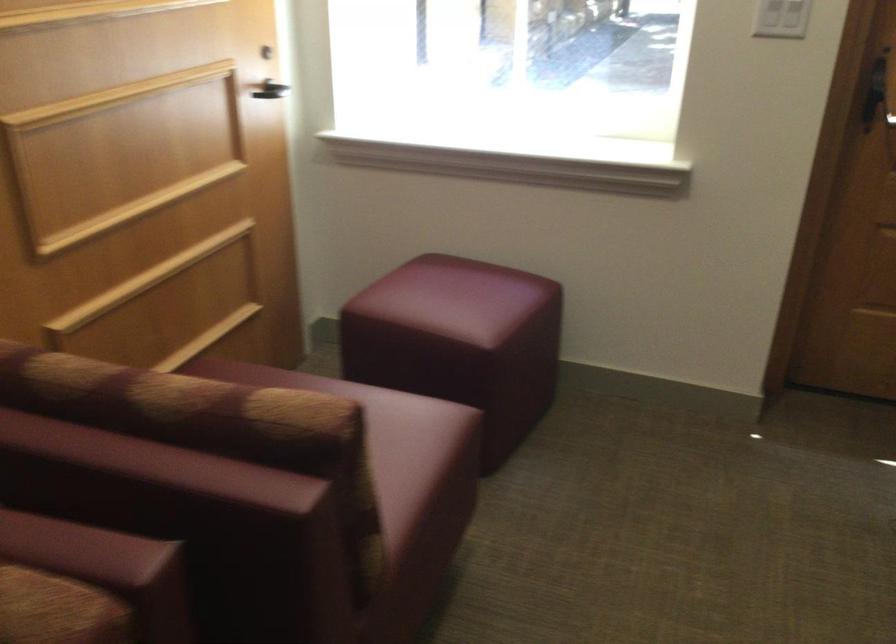
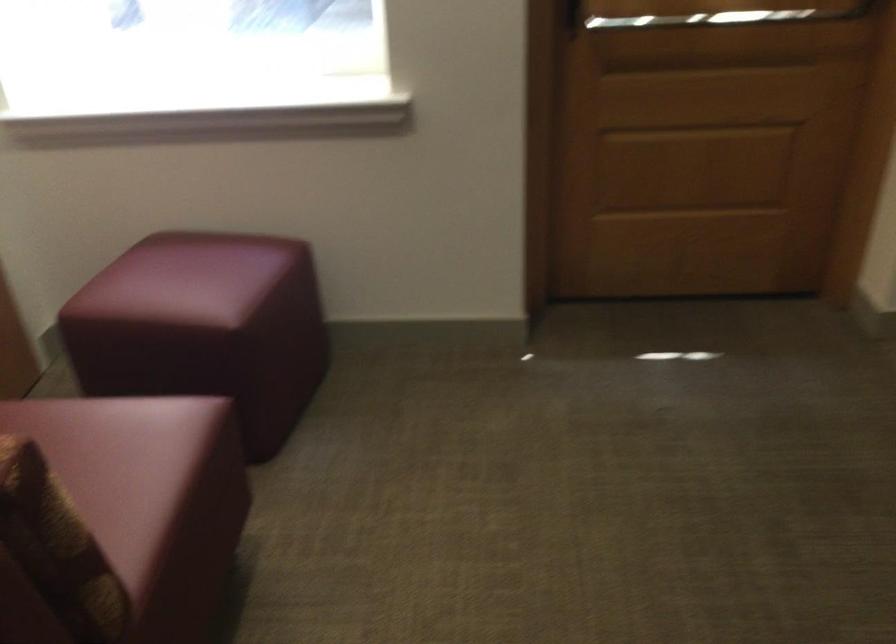
Based on the photo, what movement of the cameraman would produce the second image?

The cameraman moved toward right, forward.